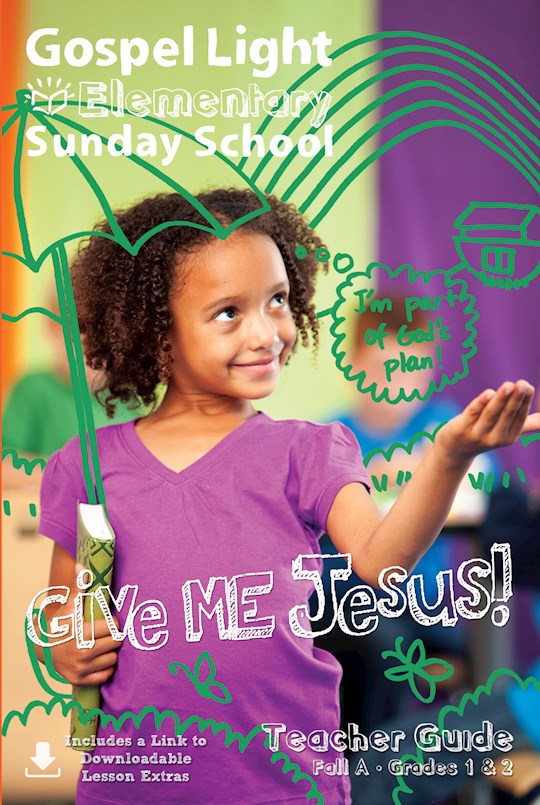
In order to click on book in this screenshot , I will do `click(99, 555)`.